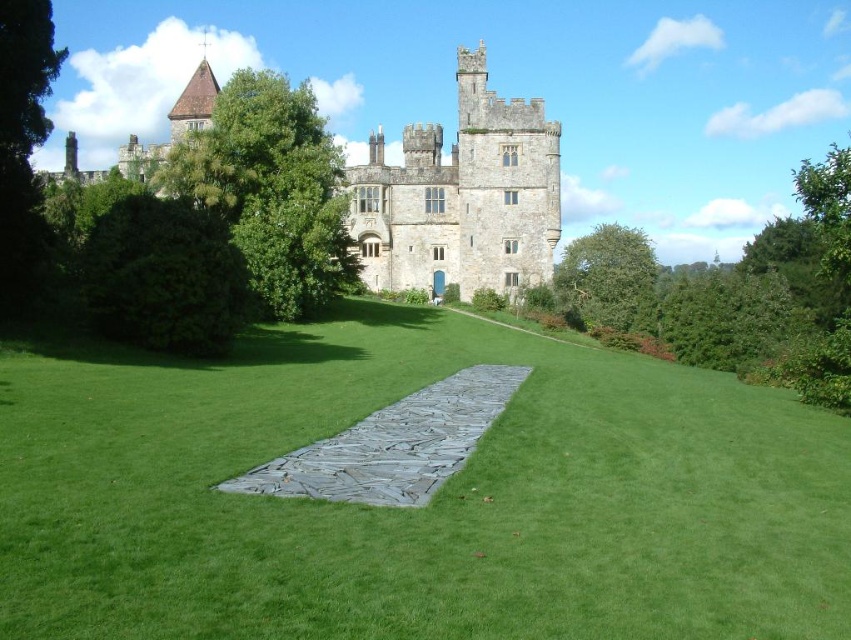
Question: Is green grass at center thinner than stone castle at center?

Choices:
 (A) yes
 (B) no

Answer: (B)

Question: In this image, where is stone castle at center located relative to gray stone path at center?

Choices:
 (A) right
 (B) left

Answer: (B)

Question: Which point is farther to the camera?

Choices:
 (A) gray stone path at center
 (B) green grass at center

Answer: (A)

Question: Does stone castle at center appear on the left side of gray stone path at center?

Choices:
 (A) no
 (B) yes

Answer: (B)

Question: Considering the real-world distances, which object is farthest from the gray stone path at center?

Choices:
 (A) green grass at center
 (B) stone castle at center

Answer: (B)

Question: Which is farther from the gray stone path at center?

Choices:
 (A) stone castle at center
 (B) green grass at center

Answer: (A)